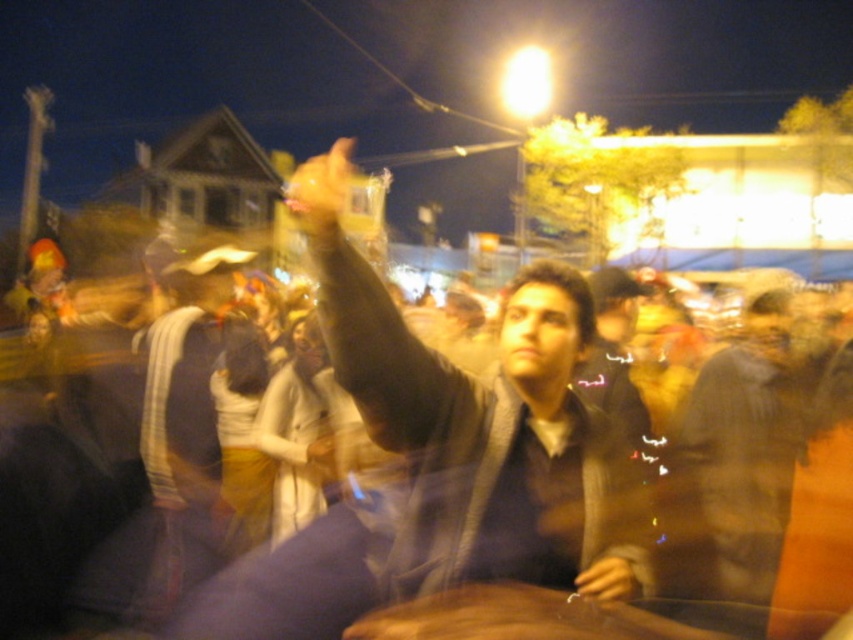
Can you confirm if yellow rubber glove at upper center is wider than smooth yellowish hand at center?

Yes.

The width and height of the screenshot is (853, 640). What are the coordinates of `yellow rubber glove at upper center` in the screenshot? It's located at (321, 188).

The image size is (853, 640). In order to click on yellow rubber glove at upper center in this screenshot , I will do `click(321, 188)`.

Image resolution: width=853 pixels, height=640 pixels. What do you see at coordinates (47, 522) in the screenshot?
I see `brown leather jacket at center` at bounding box center [47, 522].

Which is below, brown leather jacket at center or yellow rubber glove at upper center?

brown leather jacket at center is lower down.

Between point (453, 547) and point (344, 184), which one is positioned in front?

Positioned in front is point (344, 184).

In order to click on brown leather jacket at center in this screenshot , I will do `click(47, 522)`.

Which is in front, point (538, 285) or point (596, 564)?

Point (596, 564) is more forward.

Which is in front, point (364, 305) or point (619, 577)?

Positioned in front is point (619, 577).

The image size is (853, 640). I want to click on matte black jacket at center, so click(x=479, y=392).